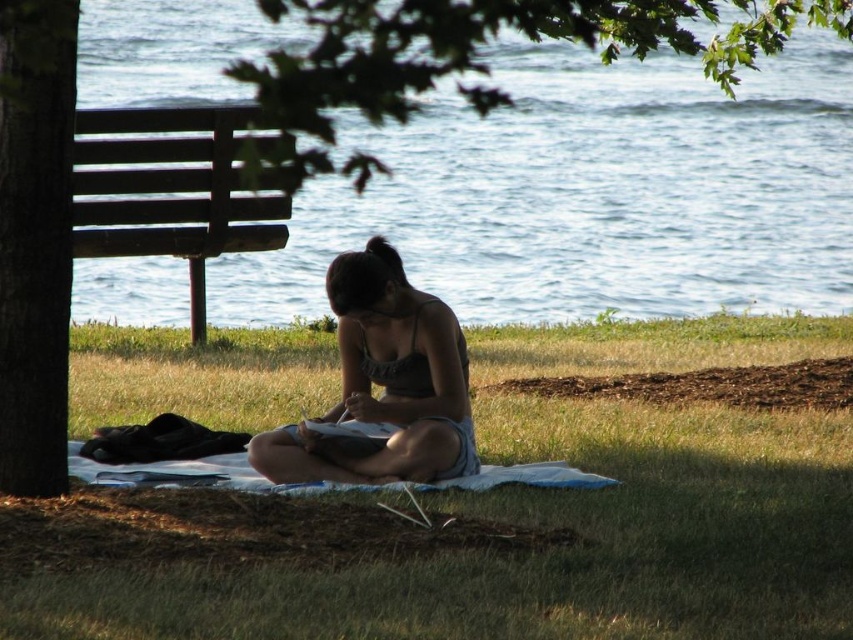
Question: In this image, where is green leafy tree at upper center located relative to brown wooden bench at left?

Choices:
 (A) right
 (B) left

Answer: (A)

Question: Can you confirm if green leafy tree at upper center is positioned below matte black tank top at center?

Choices:
 (A) yes
 (B) no

Answer: (B)

Question: Among these points, which one is farthest from the camera?

Choices:
 (A) coord(430,451)
 (B) coord(32,68)
 (C) coord(151,372)

Answer: (C)

Question: Which of the following is the closest to the observer?

Choices:
 (A) brown wooden bench at left
 (B) green grass at center

Answer: (B)

Question: Estimate the real-world distances between objects in this image. Which object is closer to the green leafy tree at upper center?

Choices:
 (A) brown rough bark tree at left
 (B) brown wooden bench at left

Answer: (A)

Question: Is brown rough bark tree at left bigger than brown wooden bench at left?

Choices:
 (A) no
 (B) yes

Answer: (A)